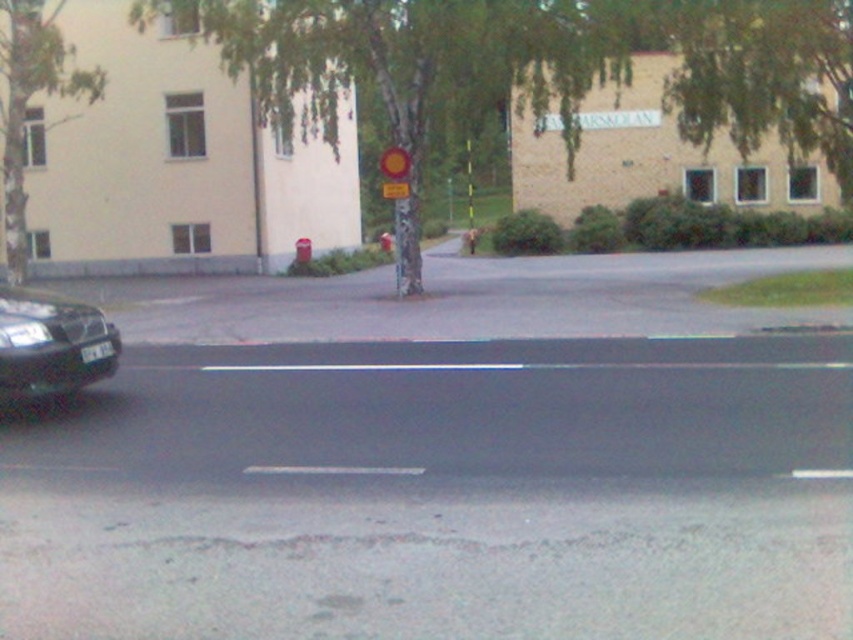
Question: Does green bark tree at center have a lesser width compared to green leafy tree at upper center?

Choices:
 (A) yes
 (B) no

Answer: (B)

Question: Which of the following is the farthest from the observer?

Choices:
 (A) green leafy tree at upper center
 (B) yellow matte circle at center
 (C) green bark tree at upper center

Answer: (C)

Question: Which object is farther from the camera taking this photo?

Choices:
 (A) green bark tree at upper center
 (B) yellow matte circle at center
 (C) shiny black car at left
 (D) green bark tree at center

Answer: (A)

Question: Does green bark tree at center have a larger size compared to yellow matte circle at center?

Choices:
 (A) no
 (B) yes

Answer: (B)

Question: Can you confirm if shiny black car at left is positioned to the right of yellow matte circle at center?

Choices:
 (A) yes
 (B) no

Answer: (B)

Question: Considering the real-world distances, which object is closest to the green bark tree at center?

Choices:
 (A) green bark tree at upper center
 (B) shiny black car at left
 (C) green leafy tree at upper center
 (D) yellow matte circle at center

Answer: (D)